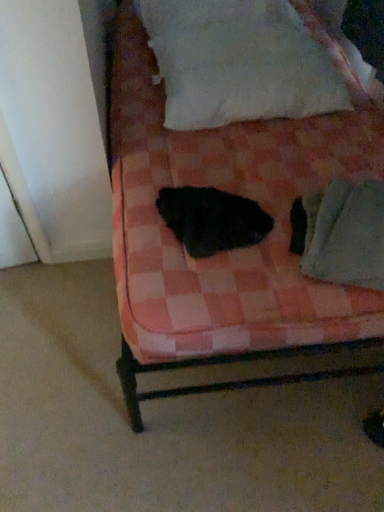
Question: Should I look upward or downward to see white cotton pillow at upper center?

Choices:
 (A) down
 (B) up

Answer: (B)

Question: From a real-world perspective, is white cotton pillow at upper center beneath green fabric at lower right?

Choices:
 (A) yes
 (B) no

Answer: (B)

Question: Is white cotton pillow at upper center wider than green fabric at lower right?

Choices:
 (A) no
 (B) yes

Answer: (B)

Question: Does white cotton pillow at upper center have a smaller size compared to green fabric at lower right?

Choices:
 (A) yes
 (B) no

Answer: (B)

Question: Can you confirm if white cotton pillow at upper center is positioned to the right of green fabric at lower right?

Choices:
 (A) no
 (B) yes

Answer: (A)

Question: Is the depth of white cotton pillow at upper center less than that of green fabric at lower right?

Choices:
 (A) yes
 (B) no

Answer: (B)

Question: Is white cotton pillow at upper center in contact with green fabric at lower right?

Choices:
 (A) yes
 (B) no

Answer: (B)

Question: Considering the relative sizes of white cotton pillow at upper center and pink checkered fabric at center in the image provided, is white cotton pillow at upper center bigger than pink checkered fabric at center?

Choices:
 (A) yes
 (B) no

Answer: (B)

Question: Is white cotton pillow at upper center far away from pink checkered fabric at center?

Choices:
 (A) no
 (B) yes

Answer: (A)

Question: Does white cotton pillow at upper center come behind pink checkered fabric at center?

Choices:
 (A) yes
 (B) no

Answer: (A)

Question: Is white cotton pillow at upper center beside pink checkered fabric at center?

Choices:
 (A) yes
 (B) no

Answer: (B)

Question: Would you say white cotton pillow at upper center contains pink checkered fabric at center?

Choices:
 (A) no
 (B) yes

Answer: (A)

Question: Does white cotton pillow at upper center have a greater height compared to pink checkered fabric at center?

Choices:
 (A) no
 (B) yes

Answer: (A)

Question: Is black fuzzy cat at center outside of green fabric at lower right?

Choices:
 (A) no
 (B) yes

Answer: (B)